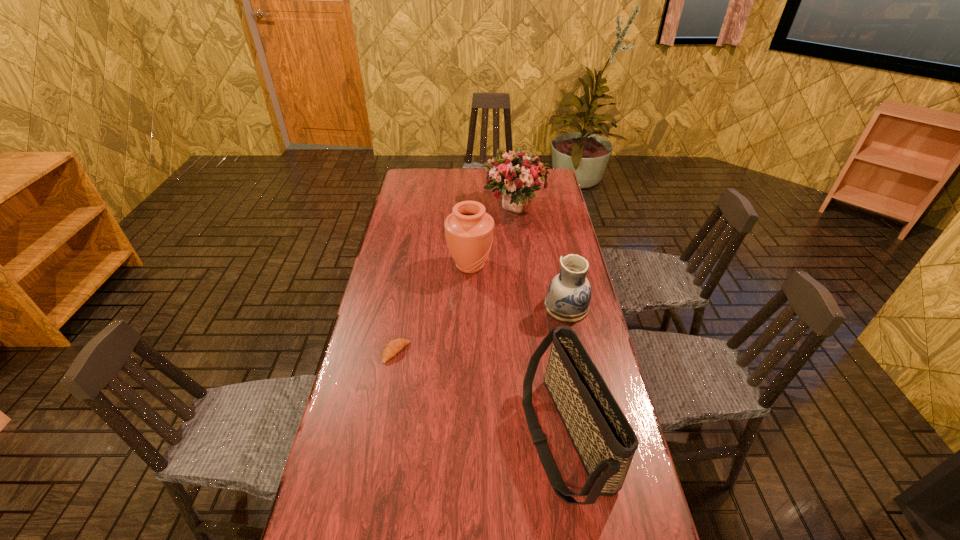
This screenshot has height=540, width=960. In order to click on empty location between the shortest object and the bouquet in this screenshot , I will do `click(455, 279)`.

Select which object appears as the fourth closest to the farthest object. Please provide its 2D coordinates. Your answer should be formatted as a tuple, i.e. [(x, y)], where the tuple contains the x and y coordinates of a point satisfying the conditions above.

[(604, 440)]

Identify which object is the second nearest to the fourth nearest object. Please provide its 2D coordinates. Your answer should be formatted as a tuple, i.e. [(x, y)], where the tuple contains the x and y coordinates of a point satisfying the conditions above.

[(517, 175)]

At what (x,y) coordinates should I click in order to perform the action: click on blank space that satisfies the following two spatial constraints: 1. on the back side of the shortest object; 2. on the left side of the pottery. Please return your answer as a coordinate pair (x, y). This screenshot has width=960, height=540. Looking at the image, I should click on (404, 307).

This screenshot has height=540, width=960. I want to click on free location that satisfies the following two spatial constraints: 1. on the back side of the crescent roll; 2. on the left side of the pottery, so click(404, 307).